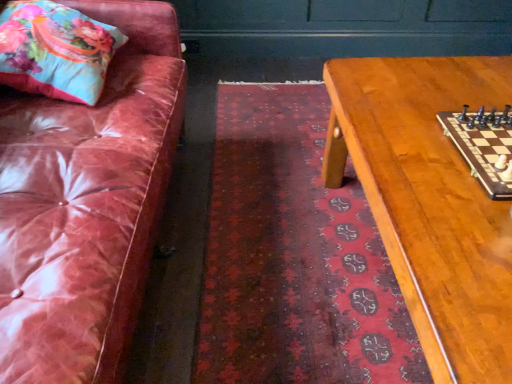
Question: Are floral fabric pillow at upper left and dark red textured rug at center making contact?

Choices:
 (A) yes
 (B) no

Answer: (B)

Question: Considering the relative positions of floral fabric pillow at upper left and dark red textured rug at center in the image provided, is floral fabric pillow at upper left in front of dark red textured rug at center?

Choices:
 (A) no
 (B) yes

Answer: (A)

Question: Is floral fabric pillow at upper left at the right side of dark red textured rug at center?

Choices:
 (A) yes
 (B) no

Answer: (B)

Question: Is floral fabric pillow at upper left shorter than dark red textured rug at center?

Choices:
 (A) yes
 (B) no

Answer: (B)

Question: From the image's perspective, is floral fabric pillow at upper left beneath dark red textured rug at center?

Choices:
 (A) yes
 (B) no

Answer: (B)

Question: From the image's perspective, is floral fabric pillow at upper left above or below wooden chessboard at right?

Choices:
 (A) above
 (B) below

Answer: (A)

Question: Considering the positions of point (69, 77) and point (446, 117), is point (69, 77) closer or farther from the camera than point (446, 117)?

Choices:
 (A) closer
 (B) farther

Answer: (B)

Question: Considering the positions of floral fabric pillow at upper left and wooden chessboard at right in the image, is floral fabric pillow at upper left wider or thinner than wooden chessboard at right?

Choices:
 (A) wide
 (B) thin

Answer: (A)

Question: From a real-world perspective, is floral fabric pillow at upper left physically located above or below wooden chessboard at right?

Choices:
 (A) below
 (B) above

Answer: (B)

Question: From the image's perspective, is wooden chessboard at right located above or below dark red textured rug at center?

Choices:
 (A) above
 (B) below

Answer: (A)

Question: Is point (501, 122) closer or farther from the camera than point (252, 340)?

Choices:
 (A) farther
 (B) closer

Answer: (B)

Question: From a real-world perspective, is wooden chessboard at right physically located above or below dark red textured rug at center?

Choices:
 (A) above
 (B) below

Answer: (A)

Question: Is wooden chessboard at right wider or thinner than dark red textured rug at center?

Choices:
 (A) thin
 (B) wide

Answer: (A)

Question: Choose the correct answer: Is wooden chessboard at center inside wooden chessboard at right or outside it?

Choices:
 (A) outside
 (B) inside

Answer: (A)

Question: Considering the positions of wooden chessboard at center and wooden chessboard at right in the image, is wooden chessboard at center taller or shorter than wooden chessboard at right?

Choices:
 (A) tall
 (B) short

Answer: (A)